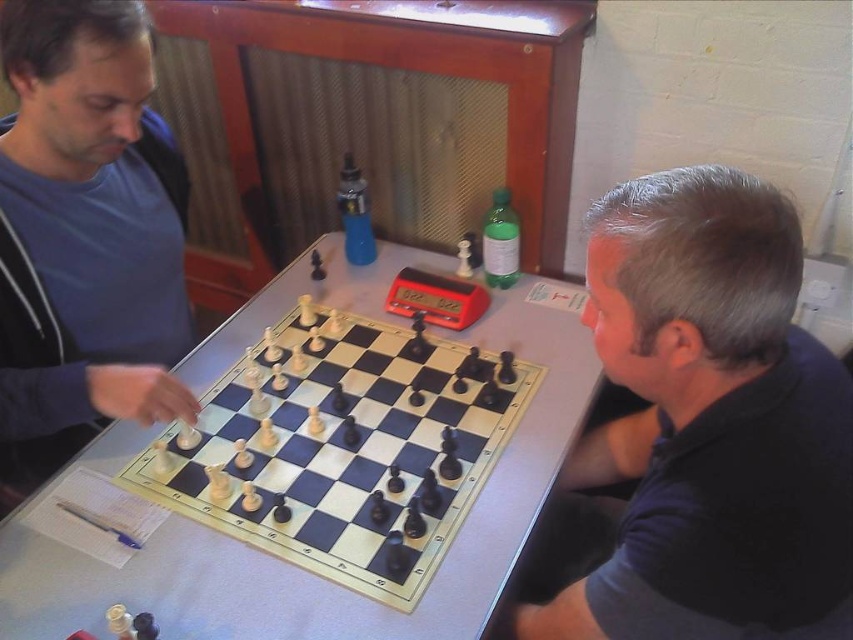
Question: Is dark blue shirt at right smaller than matte blue shirt at upper left?

Choices:
 (A) yes
 (B) no

Answer: (A)

Question: Which point is closer to the camera taking this photo?

Choices:
 (A) (444, 600)
 (B) (125, 291)
 (C) (631, 570)

Answer: (C)

Question: Which object appears farthest from the camera in this image?

Choices:
 (A) white plastic chessboard at center
 (B) dark blue shirt at right
 (C) matte blue shirt at upper left

Answer: (C)

Question: Which is farther from the white plastic chessboard at center?

Choices:
 (A) dark blue shirt at right
 (B) matte blue shirt at upper left

Answer: (A)

Question: Is dark blue shirt at right smaller than matte blue shirt at upper left?

Choices:
 (A) yes
 (B) no

Answer: (A)

Question: Is matte blue shirt at upper left above white plastic chessboard at center?

Choices:
 (A) yes
 (B) no

Answer: (A)